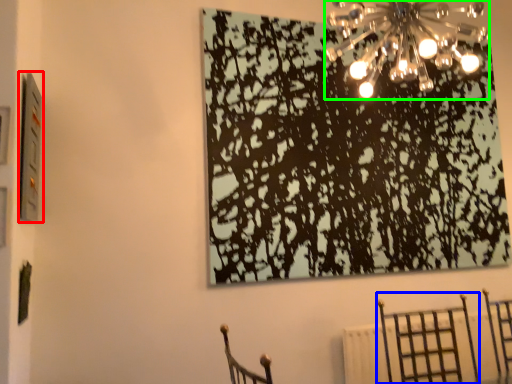
Question: Based on their relative distances, which object is farther from picture frame (highlighted by a red box)? Choose from furniture (highlighted by a blue box) and lamp (highlighted by a green box).

Choices:
 (A) furniture
 (B) lamp

Answer: (A)